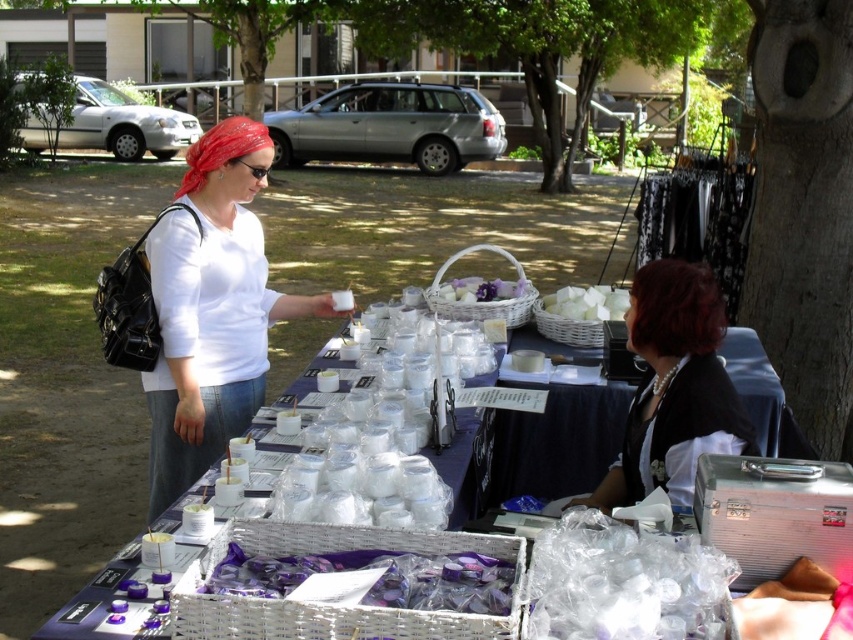
Question: Which point is farther from the camera taking this photo?

Choices:
 (A) (204, 268)
 (B) (700, 264)
 (C) (506, 593)

Answer: (B)

Question: Is pearl necklace at upper right behind white frosted cubes at center?

Choices:
 (A) no
 (B) yes

Answer: (A)

Question: Does dark red hair at center appear on the left side of white matte basket at center?

Choices:
 (A) yes
 (B) no

Answer: (B)

Question: Estimate the real-world distances between objects in this image. Which object is closer to the white matte shirt at center?

Choices:
 (A) dark red hair at center
 (B) white frosted cubes at center
 (C) transparent plastic cups at lower center

Answer: (A)

Question: Observing the image, what is the correct spatial positioning of dark red hair at center in reference to white matte basket at center?

Choices:
 (A) above
 (B) below

Answer: (B)

Question: Which point is closer to the camera?

Choices:
 (A) white matte shirt at center
 (B) white matte basket at center
 (C) white frosted cubes at center

Answer: (A)